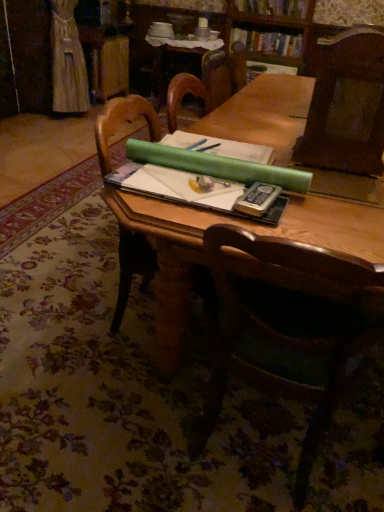
You are a GUI agent. You are given a task and a screenshot of the screen. Output one action in this format:
    pyautogui.click(x=<x>, y=<y>)
    Task: Click on the vacant area that lies to the right of hardcover book at center
    The image size is (384, 512).
    Given the screenshot: What is the action you would take?
    pyautogui.click(x=344, y=217)